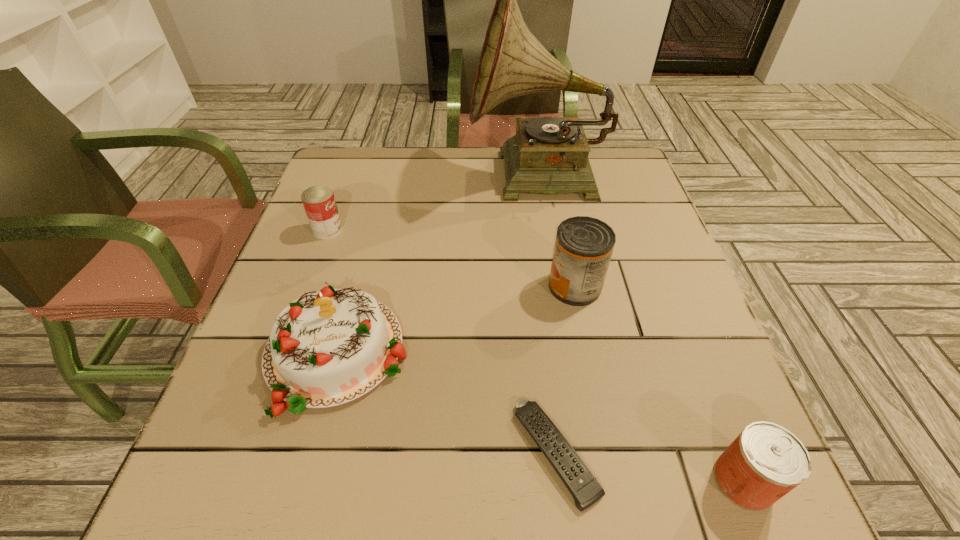
Locate an element on the screen. The width and height of the screenshot is (960, 540). free spot that satisfies the following two spatial constraints: 1. on the front label of the farthest can; 2. on the back side of the second farthest can is located at coordinates (307, 286).

This screenshot has width=960, height=540. I want to click on free spot that satisfies the following two spatial constraints: 1. on the back side of the remote control; 2. on the front label of the farthest can, so click(x=530, y=230).

Image resolution: width=960 pixels, height=540 pixels. Find the location of `vacant space that satisfies the following two spatial constraints: 1. from the horn of the tallest can; 2. on the right side of the record player`. vacant space that satisfies the following two spatial constraints: 1. from the horn of the tallest can; 2. on the right side of the record player is located at coordinates (555, 286).

Find the location of `vacant space that satisfies the following two spatial constraints: 1. on the front label of the farthest can; 2. on the left side of the rightmost can`. vacant space that satisfies the following two spatial constraints: 1. on the front label of the farthest can; 2. on the left side of the rightmost can is located at coordinates (235, 481).

You are a GUI agent. You are given a task and a screenshot of the screen. Output one action in this format:
    pyautogui.click(x=<x>, y=<y>)
    Task: Click on the blank area in the image that satisfies the following two spatial constraints: 1. on the back side of the shortest object; 2. on the front label of the leftmost can
    The image size is (960, 540).
    Given the screenshot: What is the action you would take?
    pyautogui.click(x=530, y=230)